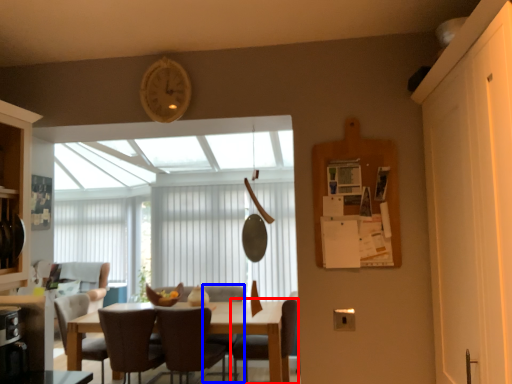
Question: Which object appears farthest to the camera in this image, chair (highlighted by a red box) or armchair (highlighted by a blue box)?

Choices:
 (A) chair
 (B) armchair

Answer: (B)